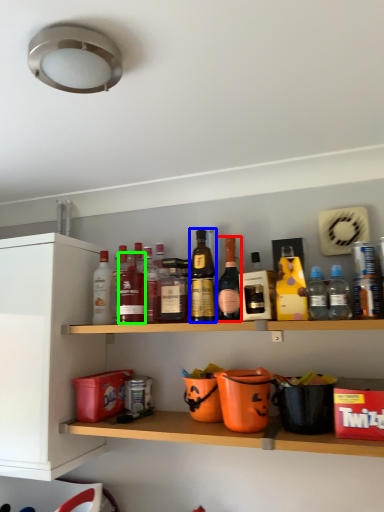
Question: Based on their relative distances, which object is nearer to bottle (highlighted by a red box)? Choose from bottle (highlighted by a blue box) and bottle (highlighted by a green box).

Choices:
 (A) bottle
 (B) bottle

Answer: (A)